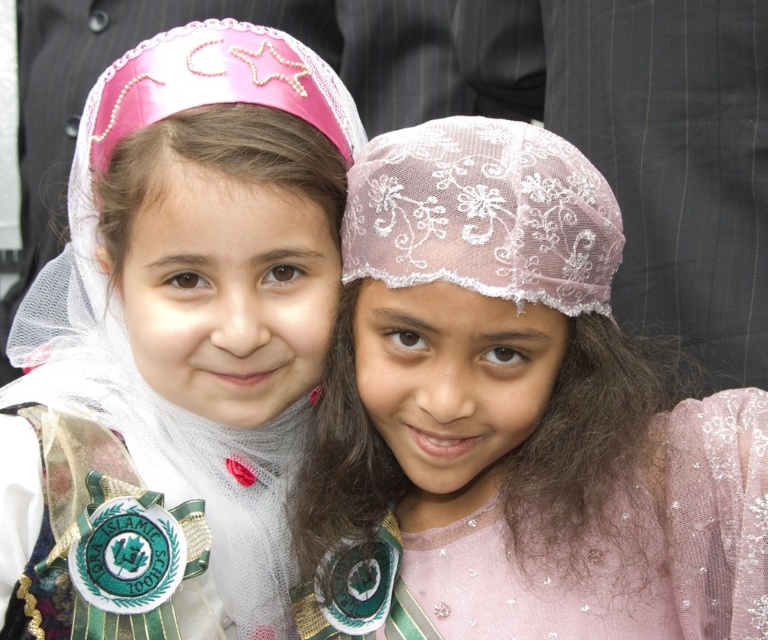
Question: Does pink lace headscarf at center have a smaller size compared to matte pink crown at upper left?

Choices:
 (A) no
 (B) yes

Answer: (B)

Question: Can you confirm if pink lace headscarf at center is thinner than matte pink crown at upper left?

Choices:
 (A) no
 (B) yes

Answer: (A)

Question: Considering the relative positions of pink lace headscarf at center and matte pink crown at upper left in the image provided, where is pink lace headscarf at center located with respect to matte pink crown at upper left?

Choices:
 (A) left
 (B) right

Answer: (B)

Question: Which object is closer to the camera taking this photo?

Choices:
 (A) lace fabric headscarf at upper center
 (B) matte pink crown at upper left

Answer: (A)

Question: Which object is the farthest from the pink lace headscarf at center?

Choices:
 (A) matte pink crown at upper left
 (B) lace fabric headscarf at upper center

Answer: (A)

Question: Among these objects, which one is farthest from the camera?

Choices:
 (A) lace fabric headscarf at upper center
 (B) matte pink crown at upper left
 (C) pink lace headscarf at center

Answer: (B)